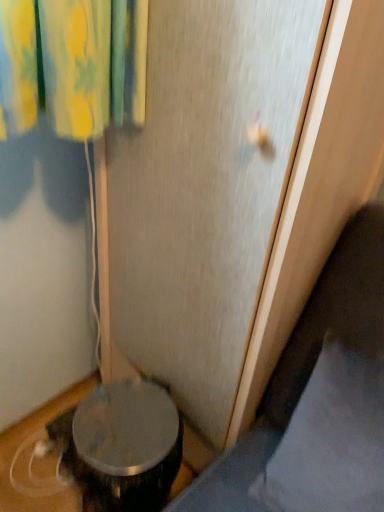
Question: Does point click(x=317, y=55) appear closer or farther from the camera than point click(x=321, y=359)?

Choices:
 (A) closer
 (B) farther

Answer: (A)

Question: Is transparent plastic screen door at center to the left or to the right of gray fabric pillow at lower right in the image?

Choices:
 (A) left
 (B) right

Answer: (A)

Question: Based on their sizes in the image, would you say transparent plastic screen door at center is bigger or smaller than gray fabric pillow at lower right?

Choices:
 (A) big
 (B) small

Answer: (A)

Question: Considering their positions, is gray fabric pillow at lower right located in front of or behind transparent plastic screen door at center?

Choices:
 (A) front
 (B) behind

Answer: (B)

Question: In terms of height, does gray fabric pillow at lower right look taller or shorter compared to transparent plastic screen door at center?

Choices:
 (A) tall
 (B) short

Answer: (B)

Question: Considering the positions of gray fabric pillow at lower right and transparent plastic screen door at center in the image, is gray fabric pillow at lower right bigger or smaller than transparent plastic screen door at center?

Choices:
 (A) small
 (B) big

Answer: (A)

Question: From the image's perspective, is gray fabric pillow at lower right above or below transparent plastic screen door at center?

Choices:
 (A) above
 (B) below

Answer: (B)